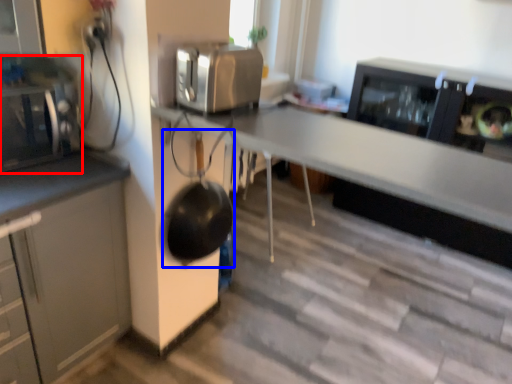
Question: Which object appears farthest to the camera in this image, home appliance (highlighted by a red box) or wok (highlighted by a blue box)?

Choices:
 (A) home appliance
 (B) wok

Answer: (B)